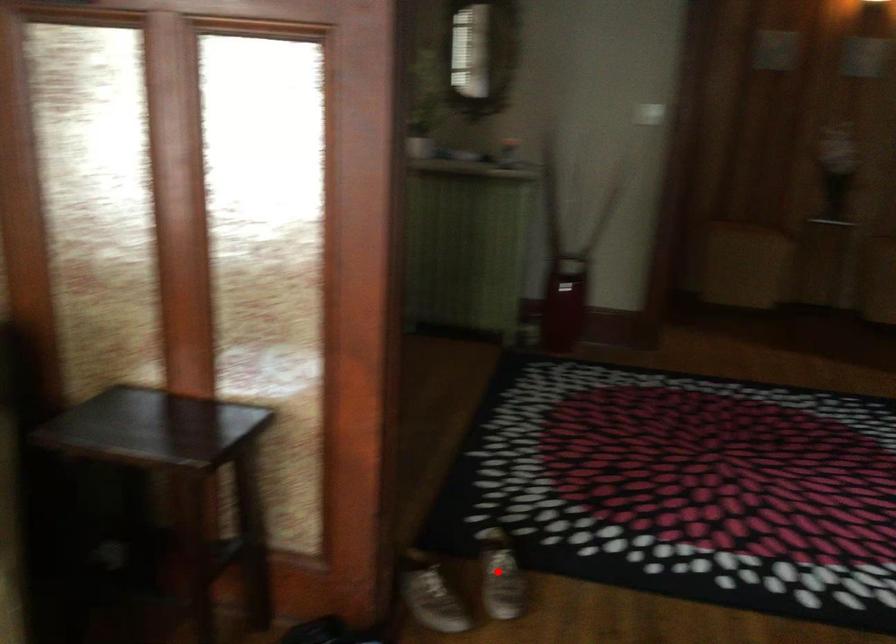
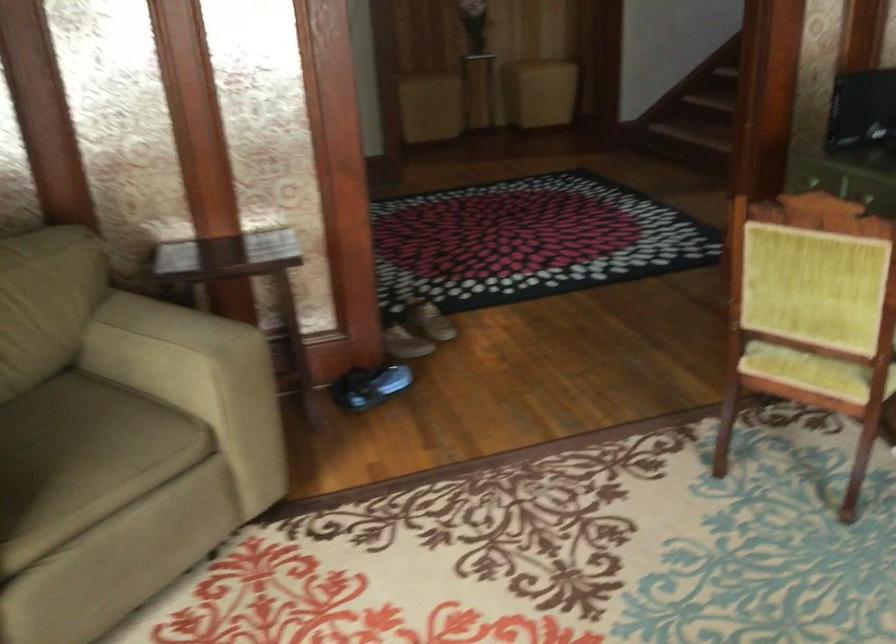
Question: I am providing you with two images of the same scene from different viewpoints. Image1 has a red point marked. In image2, the corresponding 3D location appears at what relative position? Reply with the corresponding letter.

Choices:
 (A) Closer
 (B) Farther

Answer: (B)